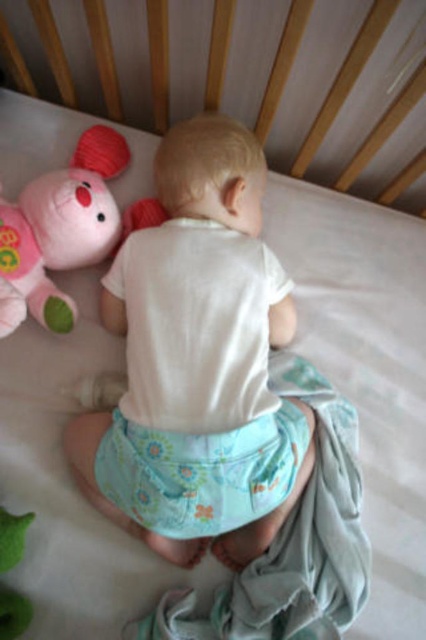
You are a caregiver checking if the baby is positioned safely in the crib. The crib has a width of 60 cm. Can the white cotton baby at center and the floral fabric diaper at center both fit side by side without overlapping?

The white cotton baby at center might be wider than the floral fabric diaper at center, so there is a possibility they cannot fit side by side within the 60 cm crib width without overlapping. Check the exact measurements for confirmation.

You are a caregiver checking on a baby in a crib. You see the white cotton baby at center and the plush pink bear at left. Which object is taller?

The white cotton baby at center is taller than the plush pink bear at left.

You are a nurse checking on a baby in the crib. You need to ensure the floral fabric diaper at center is not covering the white cotton baby at center. Based on their sizes, is this possible?

The white cotton baby at center is taller than the floral fabric diaper at center, so it is possible to position the diaper so it does not cover the baby.